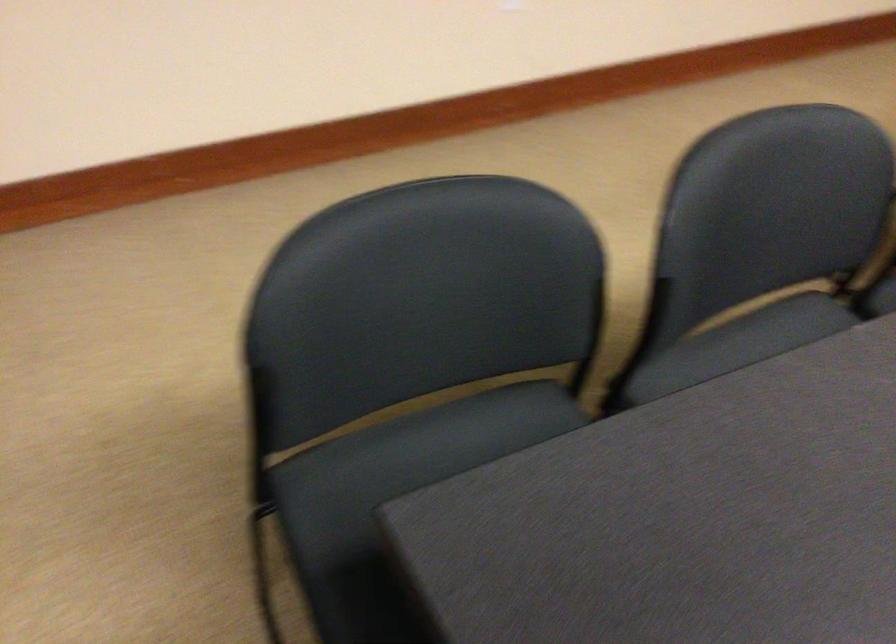
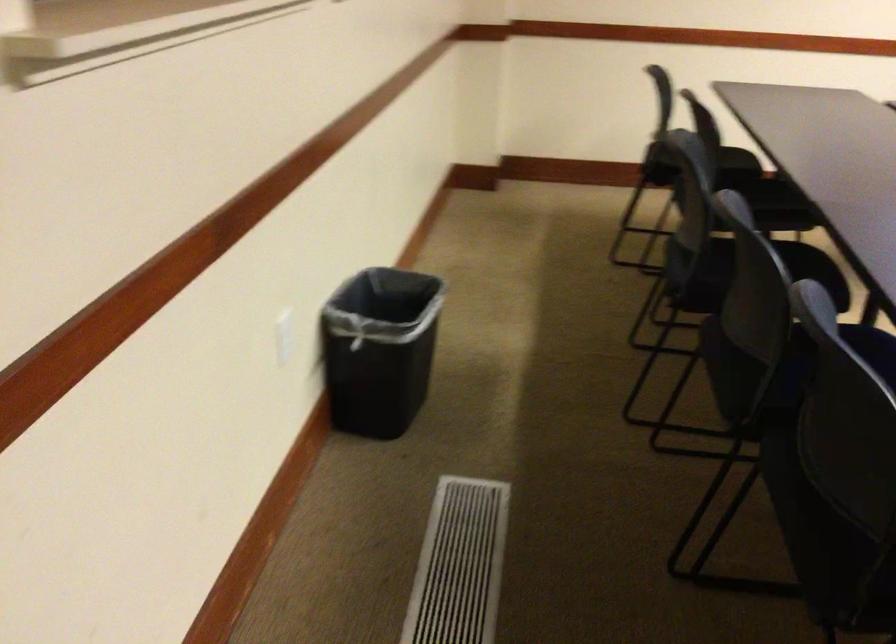
Question: The images are taken continuously from a first-person perspective. In which direction are you moving?

Choices:
 (A) Left
 (B) Right
 (C) Forward
 (D) Backward

Answer: (D)